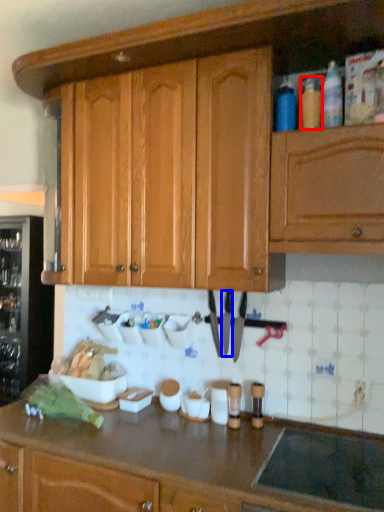
Question: Which point is closer to the camera, bottle (highlighted by a red box) or knife (highlighted by a blue box)?

Choices:
 (A) bottle
 (B) knife

Answer: (A)